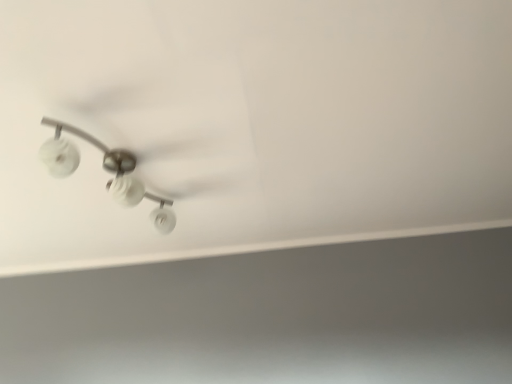
Describe the element at coordinates (105, 169) in the screenshot. I see `white glossy ceiling fan at upper left` at that location.

Image resolution: width=512 pixels, height=384 pixels. I want to click on white glossy ceiling fan at upper left, so click(x=105, y=169).

This screenshot has width=512, height=384. I want to click on white glossy ceiling fan at upper left, so click(x=105, y=169).